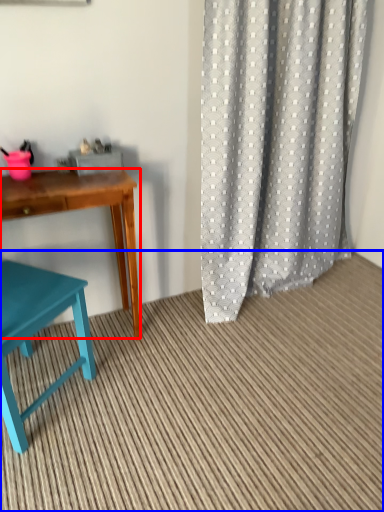
Question: Among these objects, which one is nearest to the camera, desk (highlighted by a red box) or plain (highlighted by a blue box)?

Choices:
 (A) desk
 (B) plain

Answer: (B)